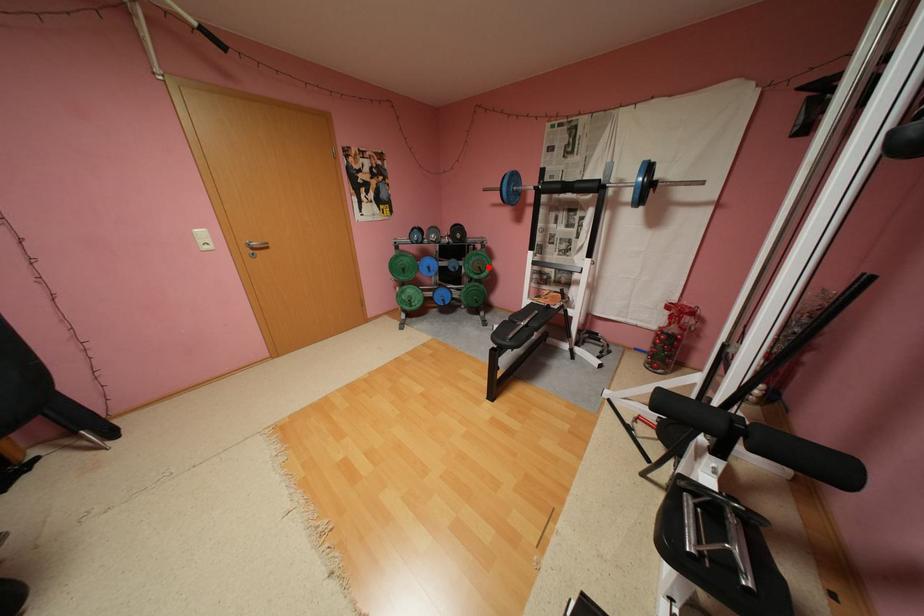
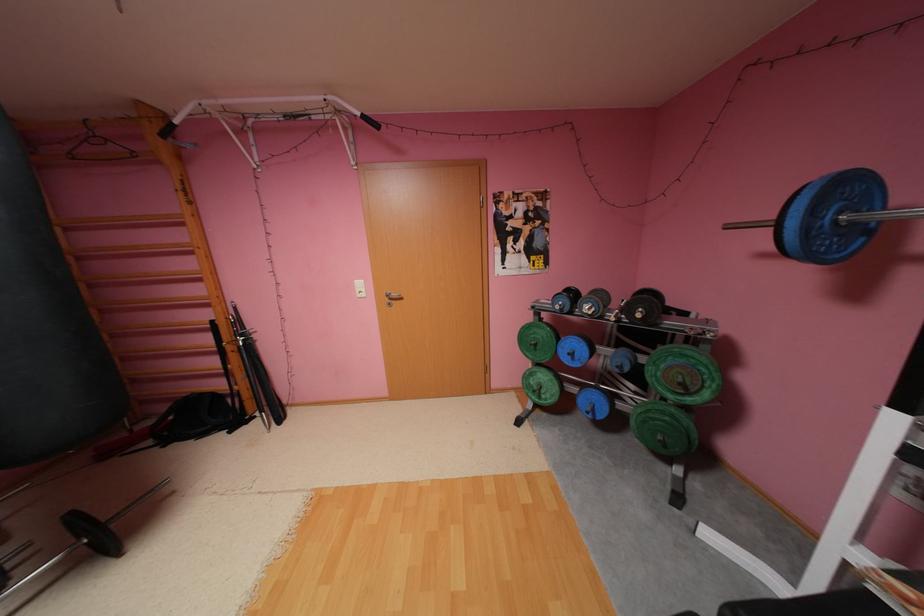
Locate, in the second image, the point that corresponds to the highlighted location in the first image.

(690, 384)